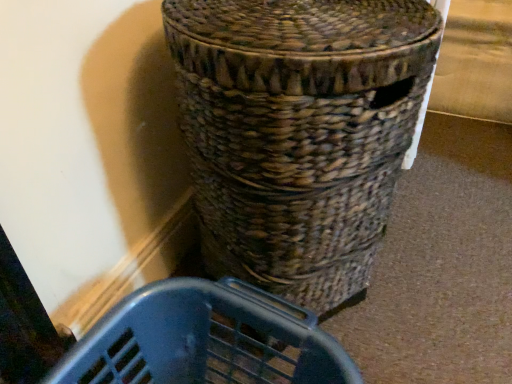
Question: Can you confirm if woven brown basket at center is positioned to the right of blue plastic laundry basket at lower center?

Choices:
 (A) yes
 (B) no

Answer: (A)

Question: From the image's perspective, is woven brown basket at center located beneath blue plastic laundry basket at lower center?

Choices:
 (A) yes
 (B) no

Answer: (B)

Question: Does woven brown basket at center have a lesser width compared to blue plastic laundry basket at lower center?

Choices:
 (A) no
 (B) yes

Answer: (A)

Question: Is woven brown basket at center directly adjacent to blue plastic laundry basket at lower center?

Choices:
 (A) no
 (B) yes

Answer: (A)

Question: Does woven brown basket at center appear on the left side of blue plastic laundry basket at lower center?

Choices:
 (A) yes
 (B) no

Answer: (B)

Question: Considering the relative sizes of woven brown basket at center and blue plastic laundry basket at lower center in the image provided, is woven brown basket at center smaller than blue plastic laundry basket at lower center?

Choices:
 (A) yes
 (B) no

Answer: (B)

Question: Is blue plastic laundry basket at lower center turned away from woven brown basket at center?

Choices:
 (A) no
 (B) yes

Answer: (A)

Question: Can you confirm if blue plastic laundry basket at lower center is thinner than woven brown basket at center?

Choices:
 (A) yes
 (B) no

Answer: (A)

Question: Does blue plastic laundry basket at lower center lie in front of woven brown basket at center?

Choices:
 (A) no
 (B) yes

Answer: (A)

Question: Does blue plastic laundry basket at lower center have a lesser height compared to woven brown basket at center?

Choices:
 (A) no
 (B) yes

Answer: (B)

Question: Does blue plastic laundry basket at lower center have a smaller size compared to woven brown basket at center?

Choices:
 (A) no
 (B) yes

Answer: (B)

Question: From a real-world perspective, is blue plastic laundry basket at lower center over woven brown basket at center?

Choices:
 (A) no
 (B) yes

Answer: (A)

Question: From the image's perspective, is blue plastic laundry basket at lower center above or below woven brown basket at center?

Choices:
 (A) above
 (B) below

Answer: (B)